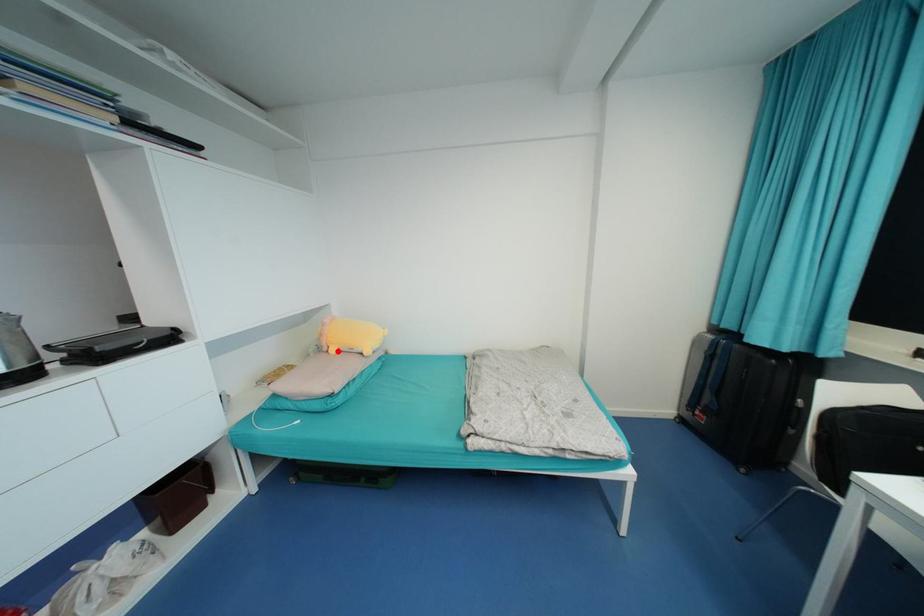
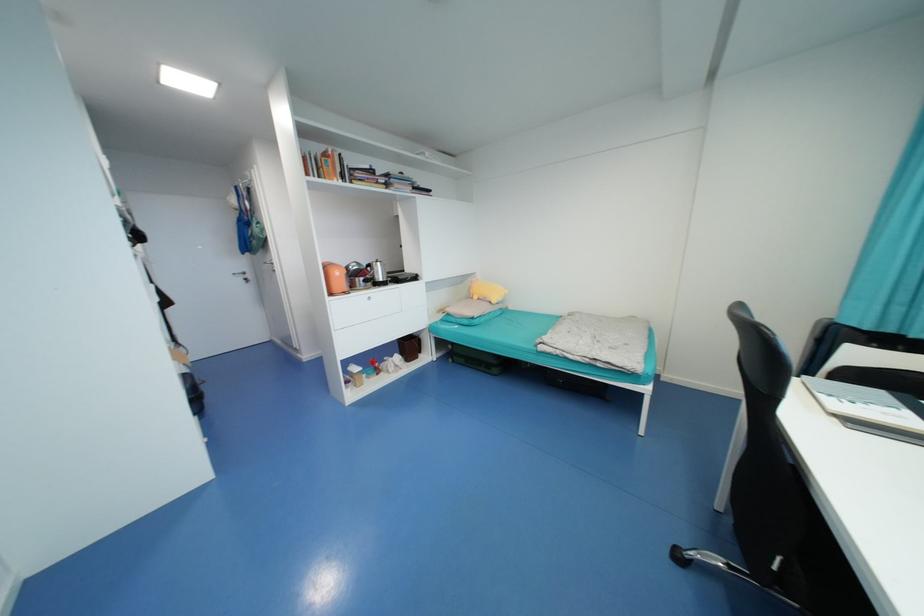
Where in the second image is the point corresponding to the highlighted location from the first image?

(480, 299)